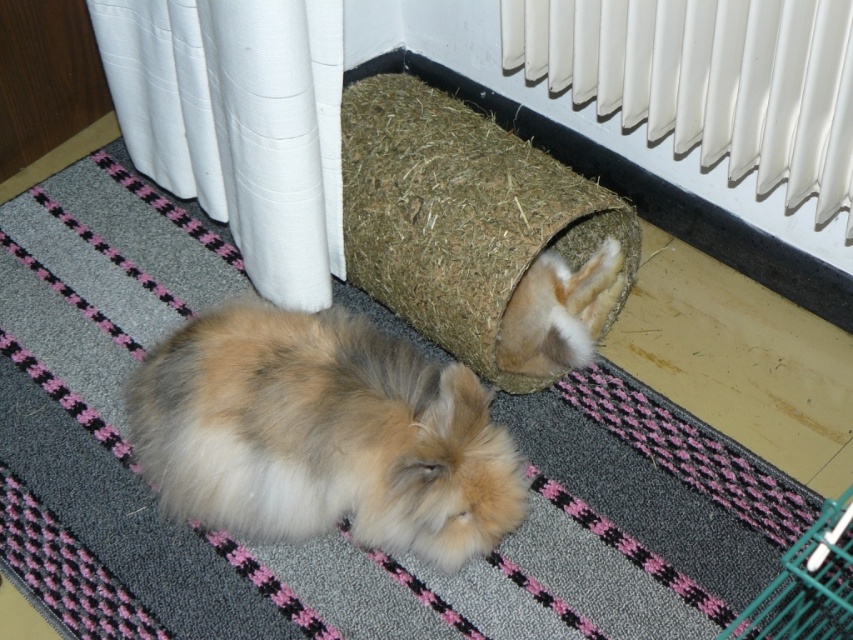
Question: Considering the real-world distances, which object is closest to the white fabric curtain at left?

Choices:
 (A) fluffy fur rabbit at center
 (B) white plastic radiator at upper right
 (C) fuzzy brown rabbit at lower center

Answer: (A)

Question: Among these points, which one is nearest to the camera?

Choices:
 (A) (135, 36)
 (B) (828, 141)
 (C) (180, 356)

Answer: (C)

Question: Is white plastic radiator at upper right to the right of fuzzy brown rabbit at lower center from the viewer's perspective?

Choices:
 (A) no
 (B) yes

Answer: (B)

Question: Does fluffy fur rabbit at center appear under white fabric curtain at left?

Choices:
 (A) yes
 (B) no

Answer: (A)

Question: Estimate the real-world distances between objects in this image. Which object is closer to the white fabric curtain at left?

Choices:
 (A) fuzzy brown rabbit at lower center
 (B) fluffy fur rabbit at center
 (C) white plastic radiator at upper right

Answer: (B)

Question: From the image, what is the correct spatial relationship of white plastic radiator at upper right in relation to fuzzy brown rabbit at lower center?

Choices:
 (A) above
 (B) below

Answer: (A)